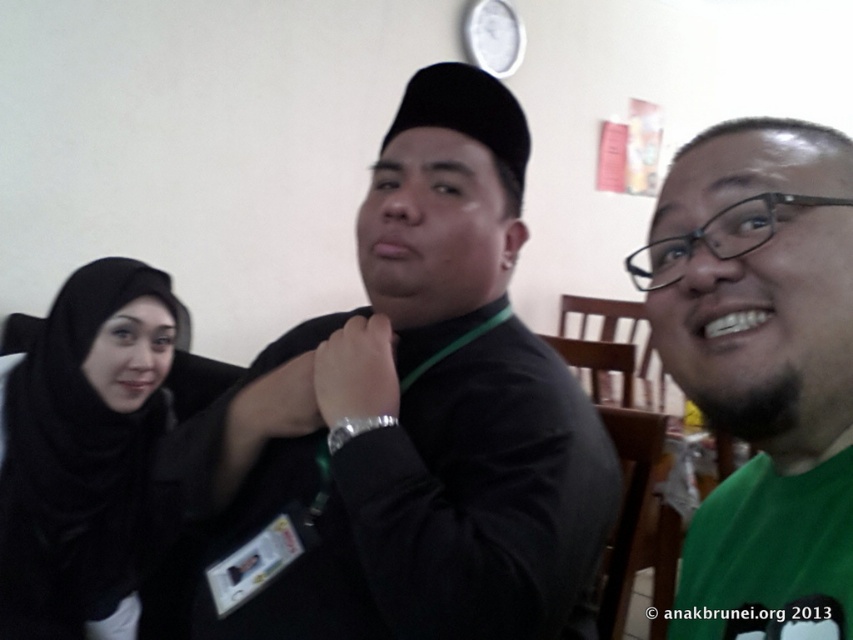
You are standing in the room and want to greet both the person wearing the black matte hijab at left and the person in the black matte shirt at center. Which person should you approach first if you want to greet the one closer to the entrance?

The black matte hijab at left is closer to the entrance than the black matte shirt at center, so you should greet the person wearing the black matte hijab at left first.

You are a photographer setting up for a group photo in the classroom. You notice the black matte shirt at center and the black matte hijab at left. Which object should you adjust to ensure both are in focus, considering their heights?

The black matte shirt at center is much taller than the black matte hijab at left. To ensure both are in focus, adjust the camera angle to account for the height difference between the two.